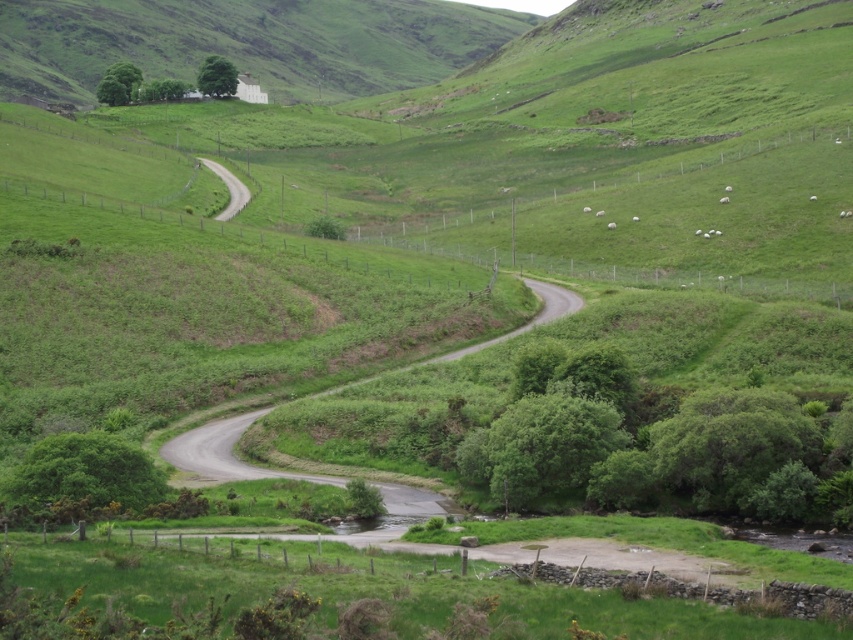
You are standing at the point marked as point (247,42) in the image. What type of terrain do you find yourself on?

The point (247,42) is located on the green grassy hillside at upper center.

You are a landscape architect planning to install a new walking path. You have to decide between placing it on the green grassy hillside at upper center or the gray asphalt road at center. Which location has a wider area to accommodate the path?

The green grassy hillside at upper center has a wider area than the gray asphalt road at center, so it can accommodate the path better.

You are a farmer checking the condition of your property. You notice the gray asphalt road at center and the white woolly sheep at center. Which one is wider?

The gray asphalt road at center is wider than the white woolly sheep at center.